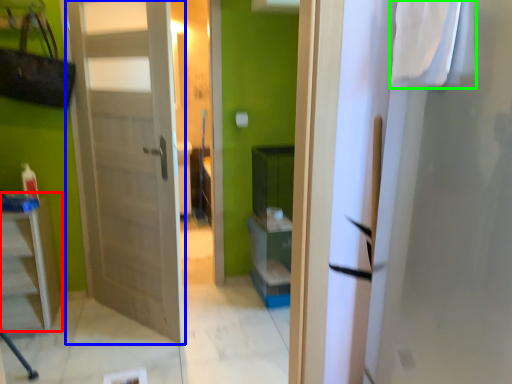
Question: Which is nearer to the furniture (highlighted by a red box)? door (highlighted by a blue box) or laundry (highlighted by a green box).

Choices:
 (A) door
 (B) laundry

Answer: (A)